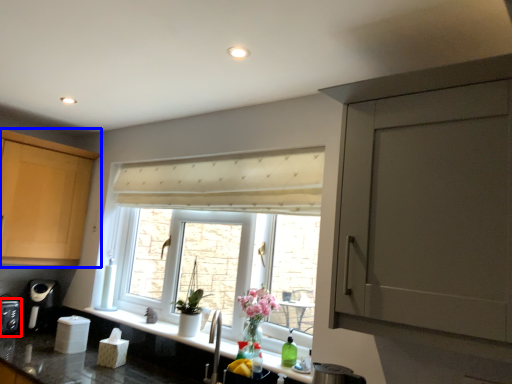
Question: Which object appears closest to the camera in this image, appliance (highlighted by a red box) or cabinetry (highlighted by a blue box)?

Choices:
 (A) appliance
 (B) cabinetry

Answer: (B)